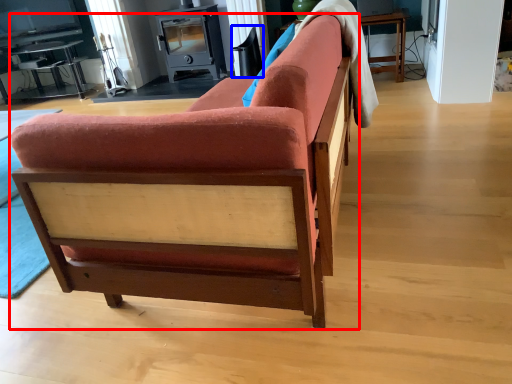
Question: Which object appears closest to the camera in this image, studio couch (highlighted by a red box) or swivel chair (highlighted by a blue box)?

Choices:
 (A) studio couch
 (B) swivel chair

Answer: (A)